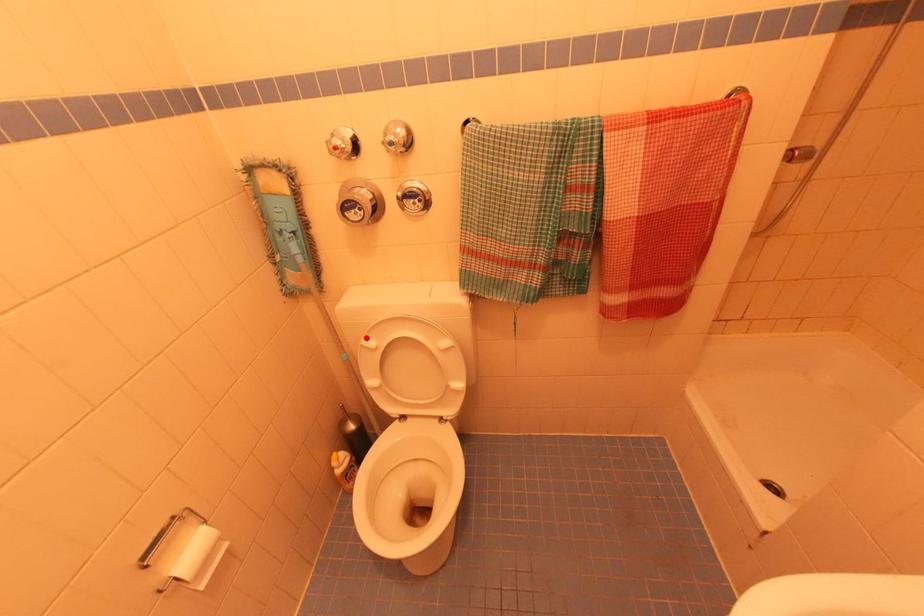
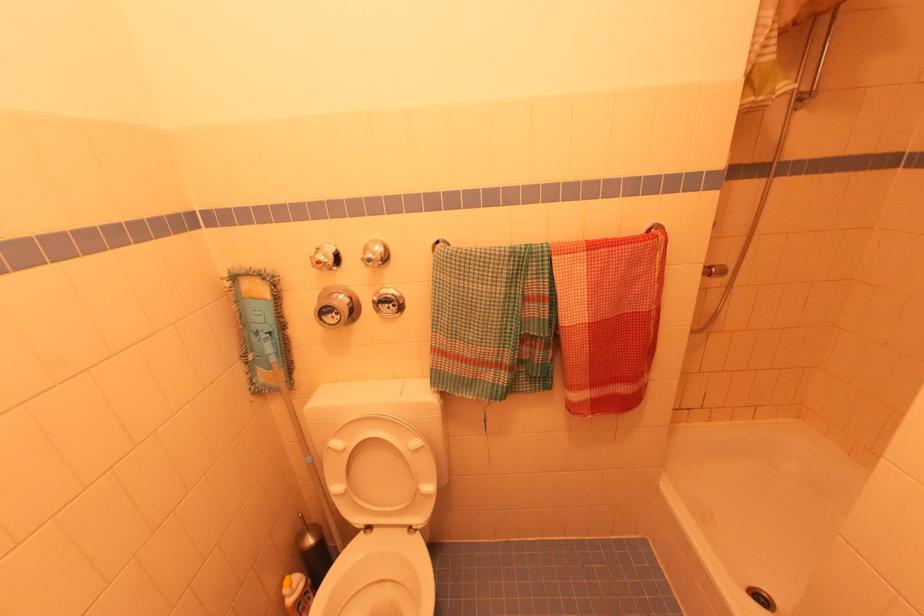
Where in the second image is the point corresponding to the highlighted location from the first image?

(334, 439)